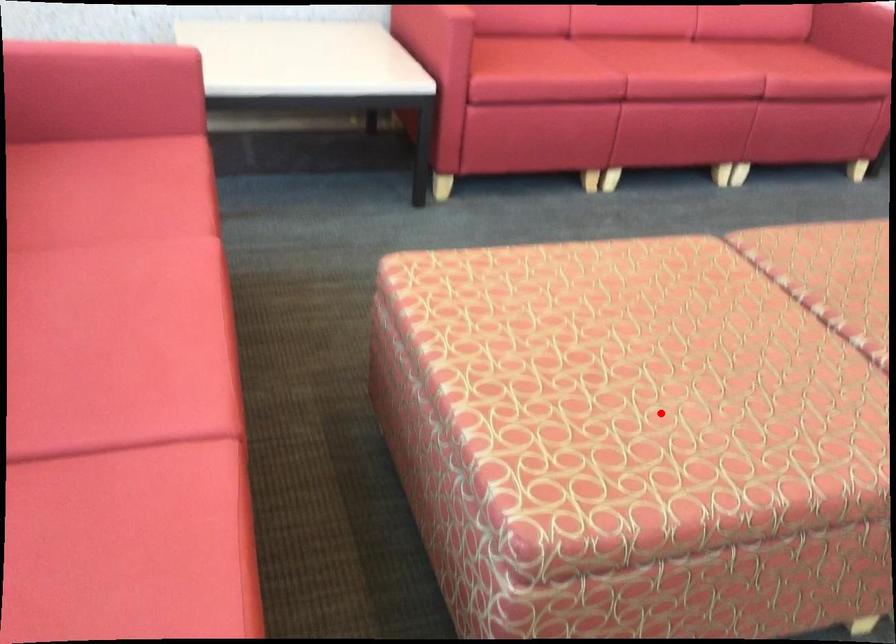
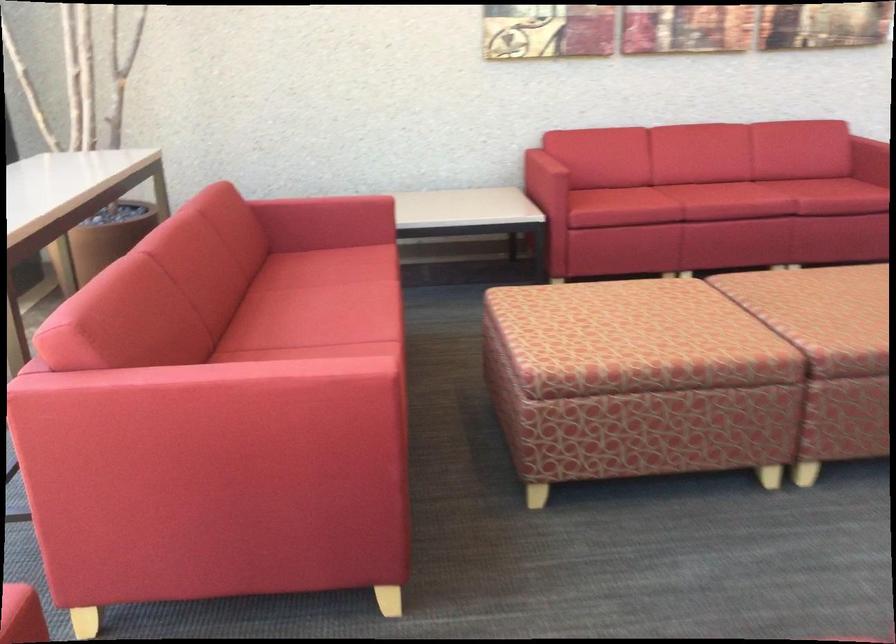
Question: I am providing you with two images of the same scene from different viewpoints. A red point is shown in image1. For the corresponding object point in image2, is it positioned nearer or farther from the camera?

Choices:
 (A) Nearer
 (B) Farther

Answer: (B)